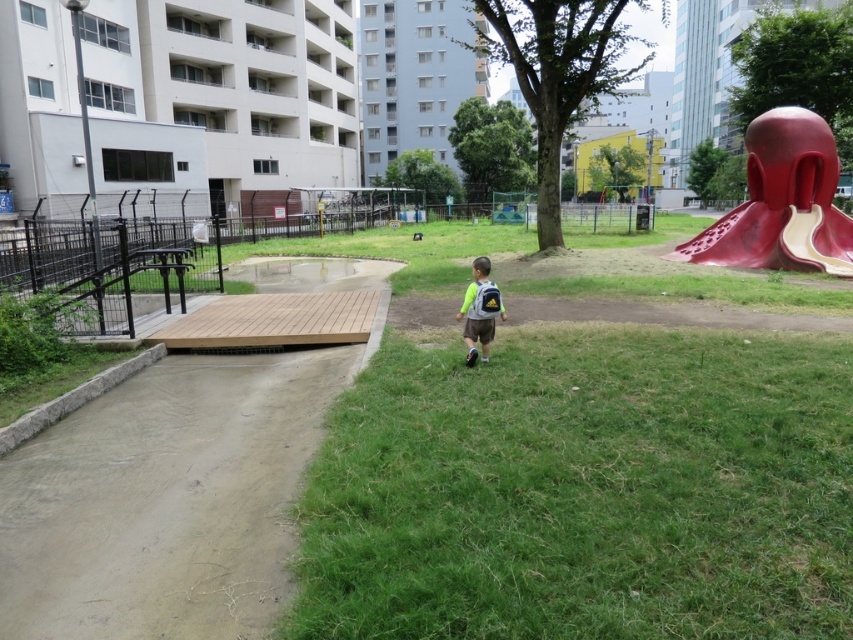
You are standing at the park and see the green grassy at lower right and the light green fabric backpack at center. Which object is positioned lower in the image?

The green grassy at lower right is located below the light green fabric backpack at center, so it is positioned lower in the image.

You are standing at the point marked by the coordinates point (584, 490). Looking towards the large red sculpture resembling a stylized head with an open mouth located on the right side of the frame, which object from the scene is directly in front of you?

The large red sculpture resembling a stylized head with an open mouth is directly in front of you as you are facing towards it from the point (584, 490).

You are a parent trying to locate your child who is carrying a light green fabric backpack at center. You see the smooth red slide at right in the park. Can you see the backpack from the slide?

The smooth red slide at right is positioned over light green fabric backpack at center, so yes, you can see the backpack from the slide because it is directly below it.